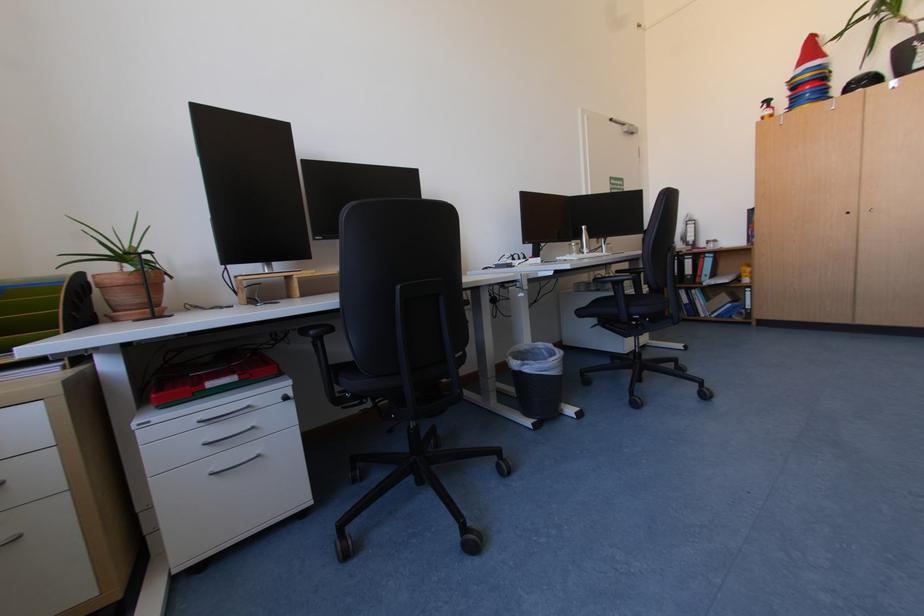
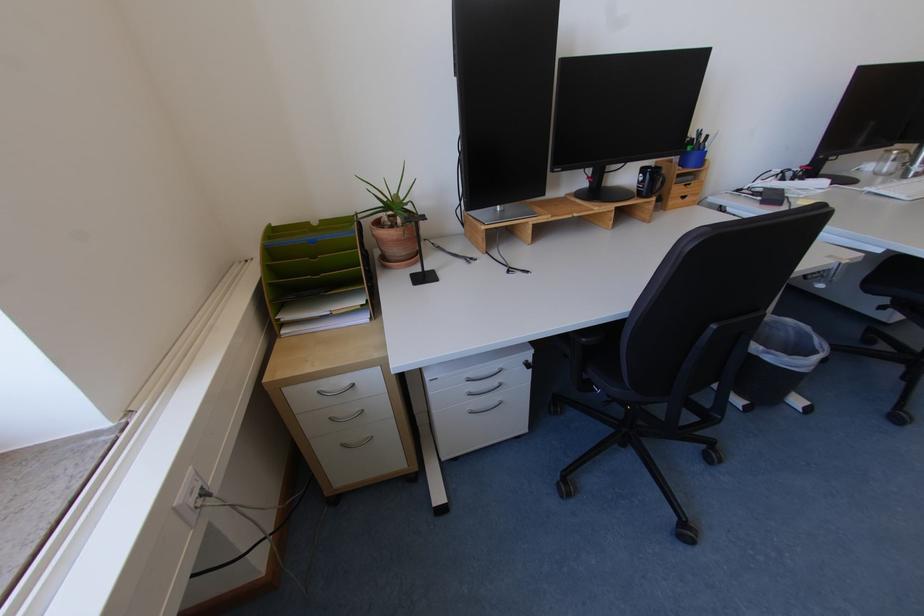
Find the pixel in the second image that matches pixel 542 421 in the first image.

(755, 403)